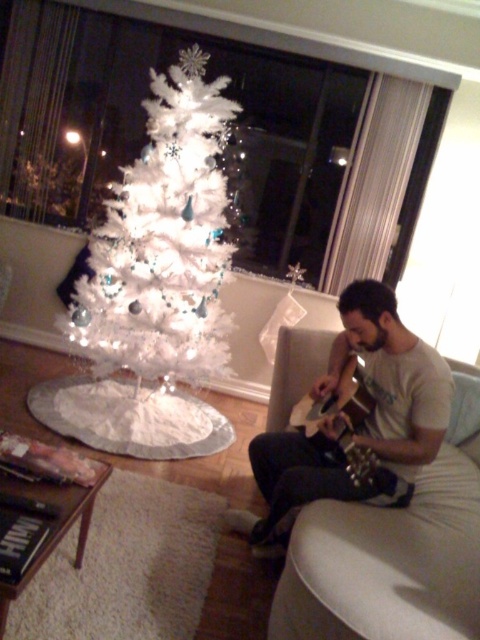
You are standing in the living room and want to take a photo of the white feathered tree at center. If your camera requires a minimum distance of 2.5 meters to focus properly, will you be able to take a clear photo from where you are?

The distance between you and the white feathered tree at center is 3.02 meters, which is more than the required 2.5 meters. Therefore, you can take a clear photo.